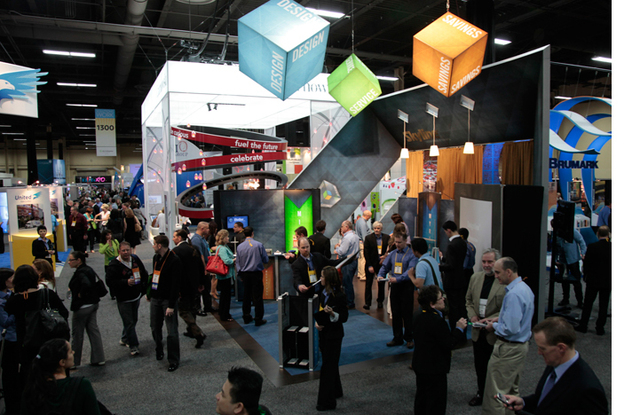
At what (x,y) coordinates should I click in order to perform the action: click on carpet. Please return your answer as a coordinate pair (x, y). This screenshot has width=640, height=415. Looking at the image, I should click on (173, 361).